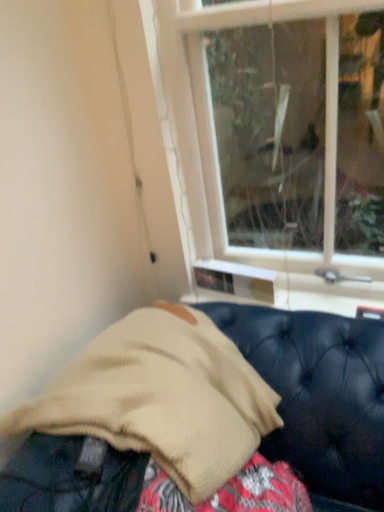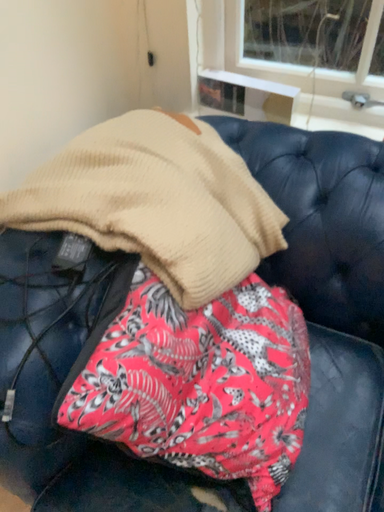
Question: Which way did the camera rotate in the video?

Choices:
 (A) rotated upward
 (B) rotated downward

Answer: (B)